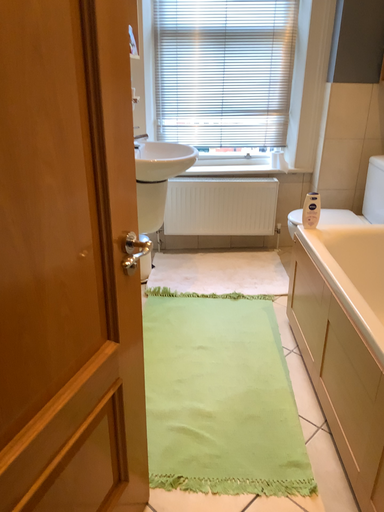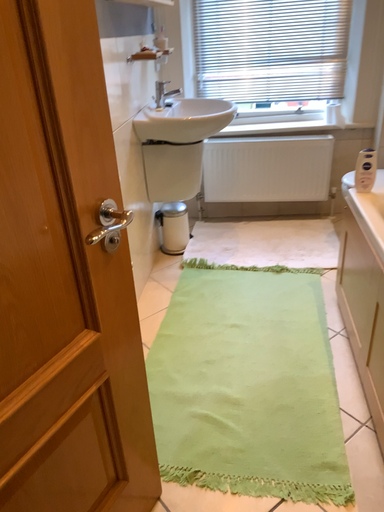
Question: Which way did the camera rotate in the video?

Choices:
 (A) rotated right
 (B) rotated left

Answer: (B)